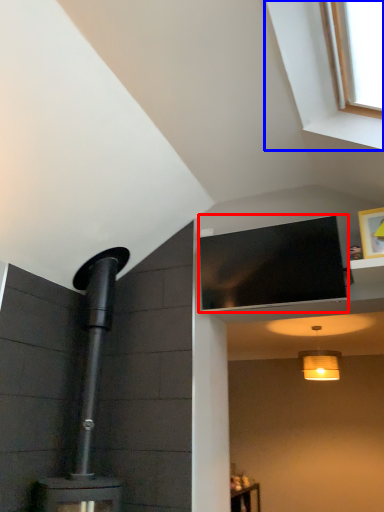
Question: Which object appears closest to the camera in this image, window screen (highlighted by a red box) or window (highlighted by a blue box)?

Choices:
 (A) window screen
 (B) window

Answer: (B)